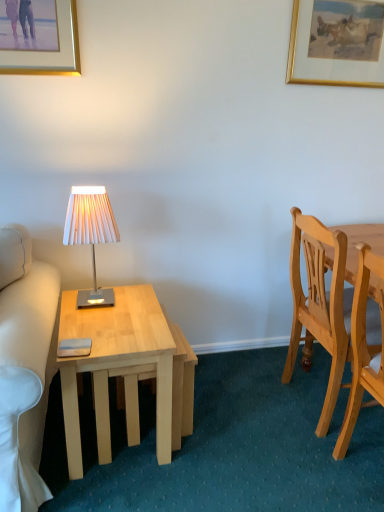
Where is `vacant region to the right of light wood desk at left`? The width and height of the screenshot is (384, 512). vacant region to the right of light wood desk at left is located at coordinates (233, 435).